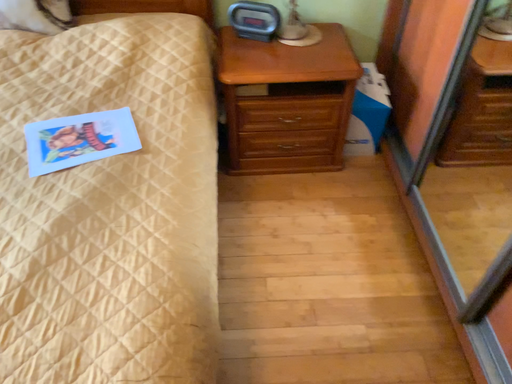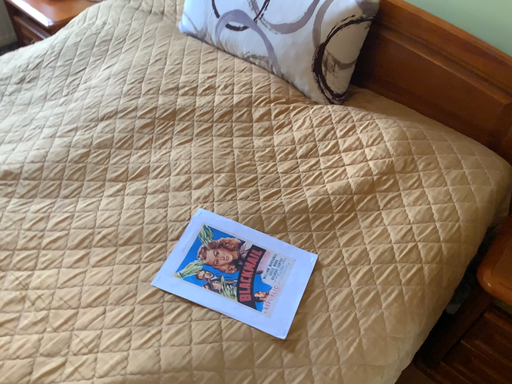
Question: Which way did the camera rotate in the video?

Choices:
 (A) rotated left
 (B) rotated right

Answer: (A)